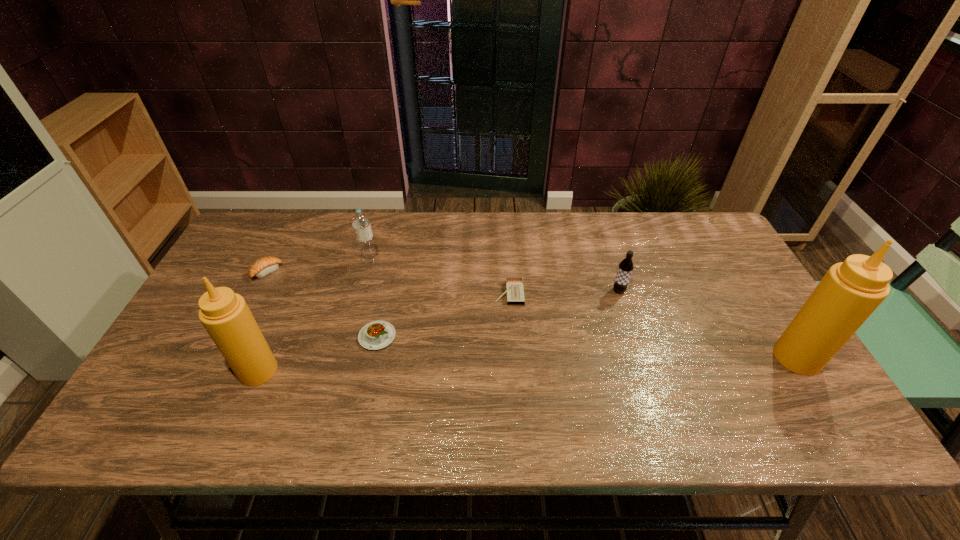
The width and height of the screenshot is (960, 540). I want to click on vacant area that lies between the sushi and the pudding, so 323,305.

Where is `empty space between the sushi and the fifth object from left to right`? empty space between the sushi and the fifth object from left to right is located at coordinates (388, 283).

This screenshot has width=960, height=540. What are the coordinates of `blank region between the water bottle and the leftmost object` in the screenshot? It's located at (319, 267).

What are the coordinates of `blank region between the shortest object and the taller condiment` in the screenshot? It's located at (653, 326).

What are the coordinates of `free point between the fifth object from left to right and the fourth shortest object` in the screenshot? It's located at (564, 292).

This screenshot has height=540, width=960. Identify the location of free point between the water bottle and the tallest object. (584, 310).

Locate an element on the screen. free space that is in between the right condiment and the shortest object is located at coordinates (653, 326).

Identify the location of free point between the pudding and the taller condiment. (588, 347).

Point out which object is positioned as the second nearest to the pudding. Please provide its 2D coordinates. Your answer should be formatted as a tuple, i.e. [(x, y)], where the tuple contains the x and y coordinates of a point satisfying the conditions above.

[(360, 222)]

Select which object appears as the sixth closest to the leftmost object. Please provide its 2D coordinates. Your answer should be formatted as a tuple, i.e. [(x, y)], where the tuple contains the x and y coordinates of a point satisfying the conditions above.

[(850, 291)]